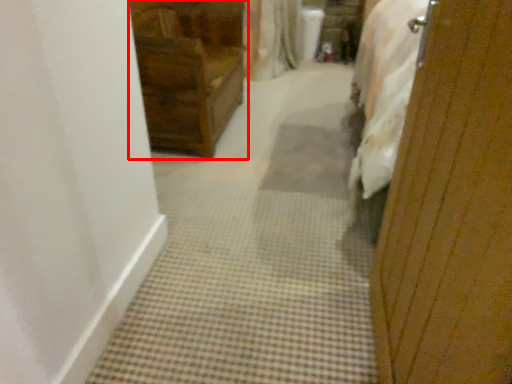
Question: From the image's perspective, where is furniture (annotated by the red box) located relative to screen door?

Choices:
 (A) above
 (B) below

Answer: (A)